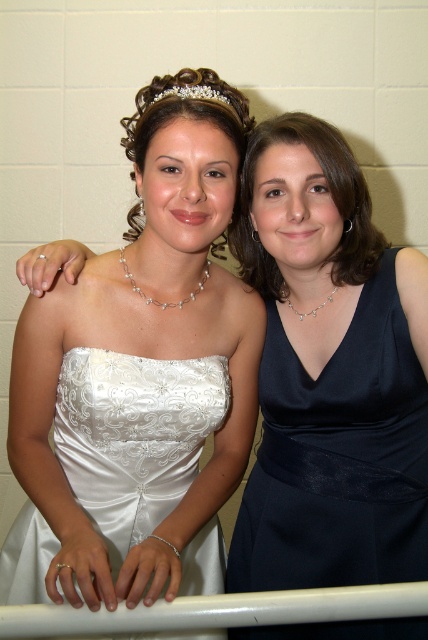
Looking at this image, you are a photographer trying to capture a closeup shot of both the satin white dress at center and the navy satin dress at right. The camera you are using has a maximum focus range of 20 centimeters. Can you fit both dresses into the frame without moving the camera?

The distance between the satin white dress at center and the navy satin dress at right is 22.84 centimeters, which exceeds the camera maximum focus range of 20 centimeters. Therefore, you cannot fit both dresses into the frame without moving the camera.

You are a photographer standing in front of the two women. You want to take a photo focusing on the satin white dress at center without the navy satin dress at right overlapping it. Is the current positioning possible?

The satin white dress at center is closer to the viewer than the navy satin dress at right, so the photographer can position the camera so that the navy satin dress at right is behind the satin white dress at center, preventing overlap.